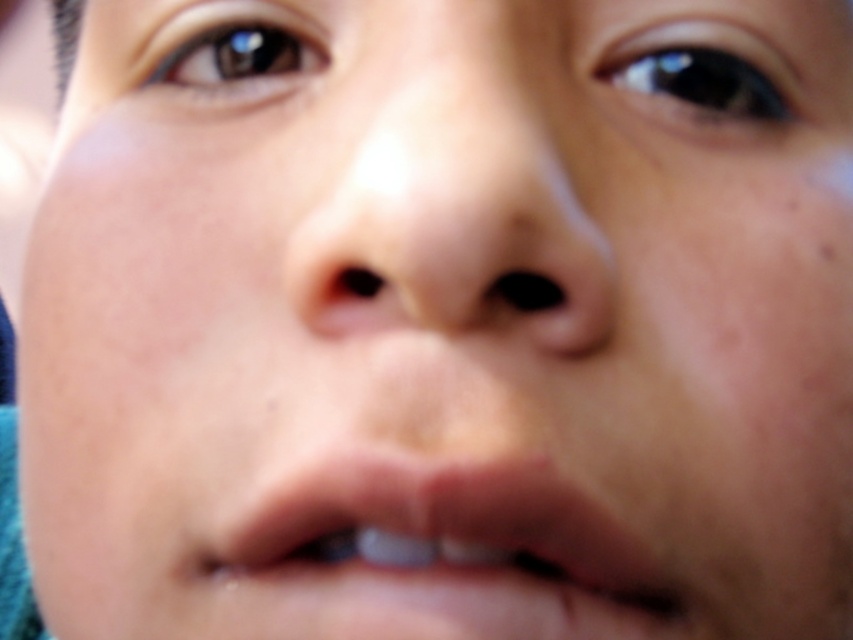
Is point (292, 232) farther from viewer compared to point (573, 540)?

Yes.

Can you confirm if smooth skin nose at center is bigger than pale pink flesh at center?

Yes, smooth skin nose at center is bigger than pale pink flesh at center.

The image size is (853, 640). Identify the location of smooth skin nose at center. (447, 192).